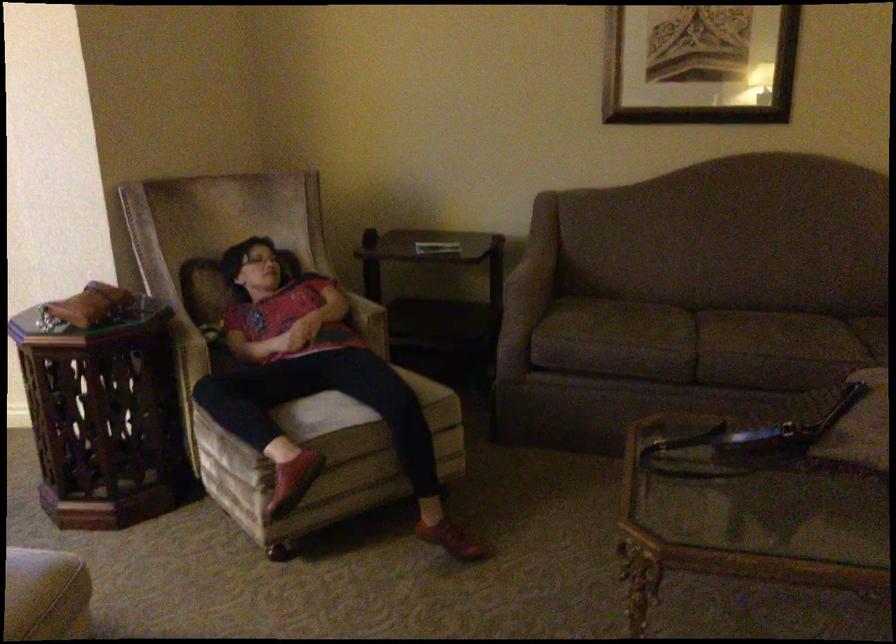
The width and height of the screenshot is (896, 644). What are the coordinates of `sofa armrest` in the screenshot? It's located at (528, 279).